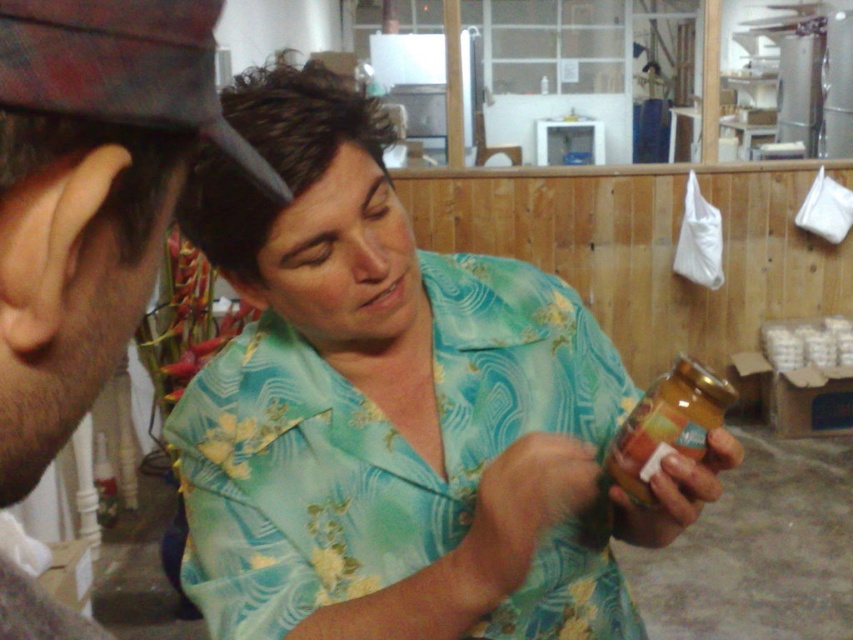
What do you see at coordinates (309, 211) in the screenshot? The height and width of the screenshot is (640, 853). I see `fluffy brown hair at center` at bounding box center [309, 211].

Which is more to the left, fluffy brown hair at center or translucent glass jar at lower center?

fluffy brown hair at center

The width and height of the screenshot is (853, 640). Describe the element at coordinates (309, 211) in the screenshot. I see `fluffy brown hair at center` at that location.

Identify the location of fluffy brown hair at center. The image size is (853, 640). (309, 211).

Based on the photo, which is more to the left, translucent glass jar at center or translucent plastic jar at center?

translucent glass jar at center

Does point (691, 396) come in front of point (674, 512)?

Yes, it is.

This screenshot has width=853, height=640. Find the location of `translucent glass jar at center`. translucent glass jar at center is located at coordinates (664, 428).

Where is `fluffy brown hair at center`? The width and height of the screenshot is (853, 640). fluffy brown hair at center is located at coordinates (309, 211).